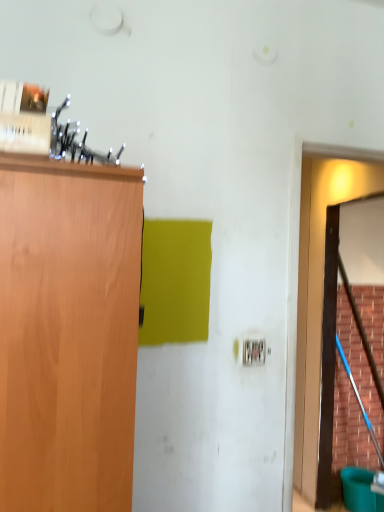
Question: Choose the correct answer: Is smooth wooden broom at right inside brown wooden door at right or outside it?

Choices:
 (A) inside
 (B) outside

Answer: (B)

Question: Based on their sizes in the image, would you say smooth wooden broom at right is bigger or smaller than brown wooden door at right?

Choices:
 (A) big
 (B) small

Answer: (B)

Question: From a real-world perspective, is smooth wooden broom at right above or below brown wooden door at right?

Choices:
 (A) below
 (B) above

Answer: (A)

Question: Relative to smooth wooden broom at right, is brown wooden door at right in front or behind?

Choices:
 (A) front
 (B) behind

Answer: (A)

Question: Looking at the image, does brown wooden door at right seem bigger or smaller compared to smooth wooden broom at right?

Choices:
 (A) big
 (B) small

Answer: (A)

Question: From the image's perspective, is brown wooden door at right positioned above or below smooth wooden broom at right?

Choices:
 (A) below
 (B) above

Answer: (B)

Question: Is brown wooden door at right wider or thinner than smooth wooden broom at right?

Choices:
 (A) wide
 (B) thin

Answer: (A)